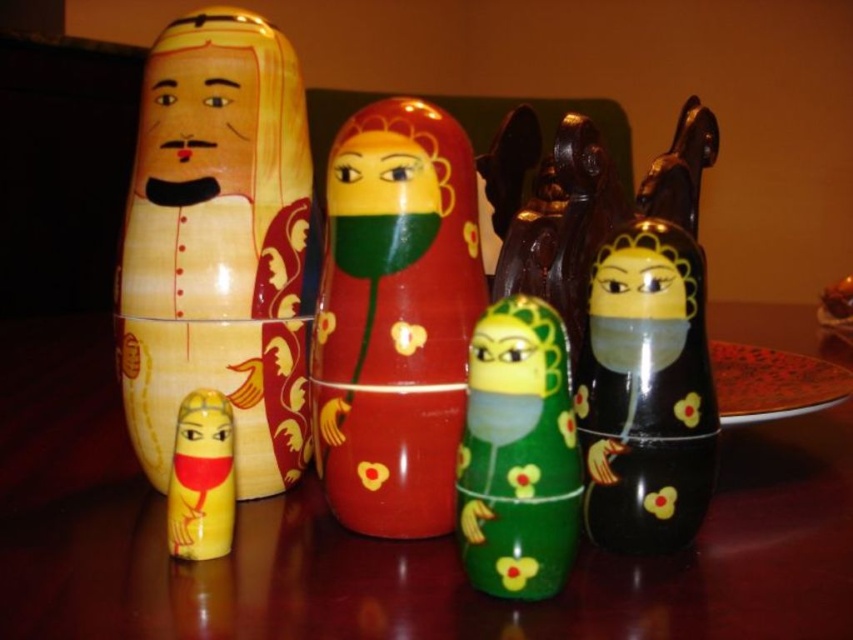
Question: Does shiny red wood nesting doll at center appear under yellow matte face at center?

Choices:
 (A) yes
 (B) no

Answer: (A)

Question: Which of the following is the farthest from the observer?

Choices:
 (A) (398, 209)
 (B) (358, 292)
 (C) (712, 468)
 (D) (671, 627)

Answer: (C)

Question: Can you confirm if shiny red wood nesting doll at center is bigger than matte yellow face at center?

Choices:
 (A) no
 (B) yes

Answer: (B)

Question: Which is nearer to the matte black doll at right?

Choices:
 (A) matte yellow doll at lower left
 (B) matte wood face at center

Answer: (A)

Question: Among these points, which one is farthest from the camera?

Choices:
 (A) (216, 108)
 (B) (730, 595)
 (C) (492, 381)

Answer: (A)

Question: Is shiny red wood nesting doll at center smaller than yellow matte face at center?

Choices:
 (A) yes
 (B) no

Answer: (B)